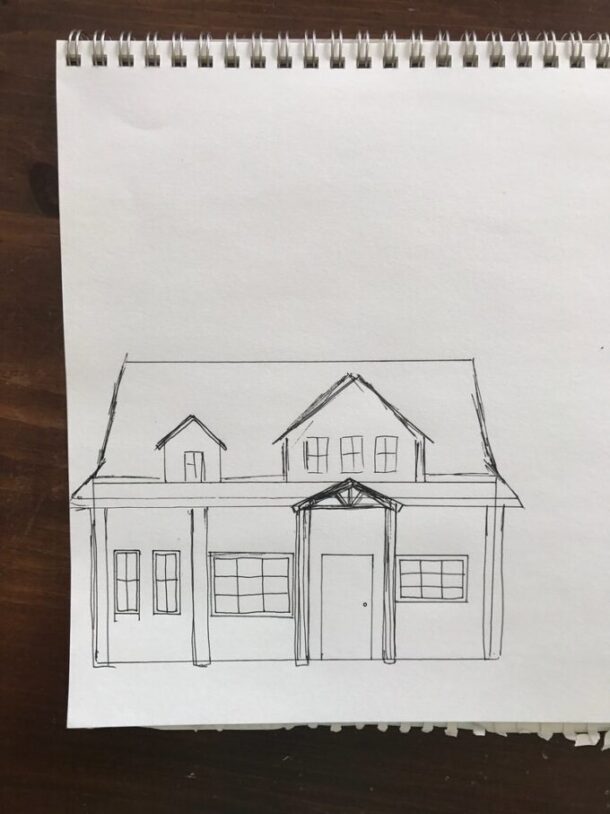
Identify the location of frame. This screenshot has width=610, height=814. (234, 563).